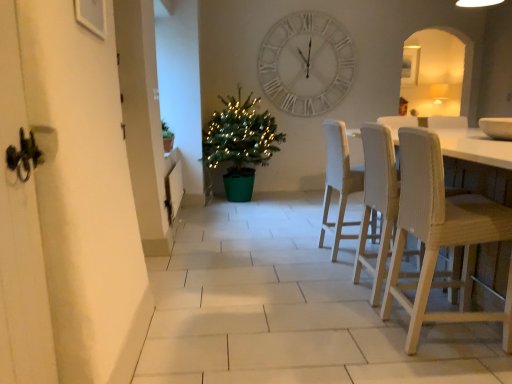
What do you see at coordinates (306, 63) in the screenshot? The height and width of the screenshot is (384, 512). I see `white matte wall clock at upper center` at bounding box center [306, 63].

This screenshot has width=512, height=384. I want to click on green plastic potted plant at center, so click(240, 143).

The height and width of the screenshot is (384, 512). Describe the element at coordinates (339, 182) in the screenshot. I see `white fabric chair at center, which is counted as the first chair, starting from the back` at that location.

What is the approximate width of white woven chair at right, marked as the second chair in a front-to-back arrangement?

white woven chair at right, marked as the second chair in a front-to-back arrangement, is 50.85 centimeters in width.

Where is `white matte wall clock at upper center`? This screenshot has width=512, height=384. white matte wall clock at upper center is located at coordinates (306, 63).

Does green plastic potted plant at center have a greater width compared to white matte wall clock at upper center?

Indeed, green plastic potted plant at center has a greater width compared to white matte wall clock at upper center.

Is green plastic potted plant at center beside white matte wall clock at upper center?

No, green plastic potted plant at center is not next to white matte wall clock at upper center.

How different are the orientations of green plastic potted plant at center and white matte wall clock at upper center in degrees?

1.63 degrees separate the facing orientations of green plastic potted plant at center and white matte wall clock at upper center.

Would you say white woven chair at right, which is counted as the 3th chair, starting from the back, is inside or outside white woven chair at right, the 2th chair from the back?

white woven chair at right, which is counted as the 3th chair, starting from the back, is not inside white woven chair at right, the 2th chair from the back, it's outside.

Considering the relative sizes of white woven chair at right, which is counted as the 3th chair, starting from the back, and white woven chair at right, marked as the second chair in a front-to-back arrangement, in the image provided, is white woven chair at right, which is counted as the 3th chair, starting from the back, wider than white woven chair at right, marked as the second chair in a front-to-back arrangement,?

In fact, white woven chair at right, which is counted as the 3th chair, starting from the back, might be narrower than white woven chair at right, marked as the second chair in a front-to-back arrangement.

Which chair is the 1st one when counting from the left side of the white woven chair at right, which appears as the first chair when viewed from the front? Please provide its 2D coordinates.

[(379, 193)]

Consider the image. Does white woven chair at right, which appears as the first chair when viewed from the front, turn towards white woven chair at right, marked as the second chair in a front-to-back arrangement?

No, white woven chair at right, which appears as the first chair when viewed from the front, is not oriented towards white woven chair at right, marked as the second chair in a front-to-back arrangement.

Is the position of white woven chair at right, which is counted as the 3th chair, starting from the back, more distant than that of white matte wall clock at upper center?

No, the depth of white woven chair at right, which is counted as the 3th chair, starting from the back, is less than that of white matte wall clock at upper center.

Does white woven chair at right, which appears as the first chair when viewed from the front, appear on the left side of white matte wall clock at upper center?

No, white woven chair at right, which appears as the first chair when viewed from the front, is not to the left of white matte wall clock at upper center.

Looking at this image, is white woven chair at right, which appears as the first chair when viewed from the front, not close to white matte wall clock at upper center?

Yes.

Is white woven chair at right, which is counted as the 3th chair, starting from the back, aimed at white matte wall clock at upper center?

No, white woven chair at right, which is counted as the 3th chair, starting from the back, does not turn towards white matte wall clock at upper center.

Starting from the white fabric chair at center, acting as the third chair starting from the front, which chair is the 1st one in front? Please provide its 2D coordinates.

[(379, 193)]

Considering the sizes of white woven chair at right, marked as the second chair in a front-to-back arrangement, and white fabric chair at center, acting as the third chair starting from the front, in the image, is white woven chair at right, marked as the second chair in a front-to-back arrangement, taller or shorter than white fabric chair at center, acting as the third chair starting from the front,?

Considering their sizes, white woven chair at right, marked as the second chair in a front-to-back arrangement, has less height than white fabric chair at center, acting as the third chair starting from the front.

Can you tell me how much white woven chair at right, the 2th chair from the back, and white fabric chair at center, acting as the third chair starting from the front, differ in facing direction?

The angle between the facing direction of white woven chair at right, the 2th chair from the back, and the facing direction of white fabric chair at center, acting as the third chair starting from the front, is 2.5 degrees.

Can you confirm if white woven chair at right, marked as the second chair in a front-to-back arrangement, is positioned to the right of white fabric chair at center, acting as the third chair starting from the front?

Yes.

Is white fabric chair at center, which is counted as the first chair, starting from the back, next to white woven chair at right, the 2th chair from the back, and touching it?

No.

Relative to white woven chair at right, the 2th chair from the back, is white fabric chair at center, acting as the third chair starting from the front, in front or behind?

In the image, white fabric chair at center, acting as the third chair starting from the front, appears behind white woven chair at right, the 2th chair from the back.

From a real-world perspective, is white fabric chair at center, acting as the third chair starting from the front, on top of white woven chair at right, the 2th chair from the back?

No.

Who is smaller, white fabric chair at center, which is counted as the first chair, starting from the back, or white woven chair at right, marked as the second chair in a front-to-back arrangement?

Smaller between the two is white woven chair at right, marked as the second chair in a front-to-back arrangement.

Which object is further away from the camera, white woven chair at right, the 2th chair from the back, or white matte wall clock at upper center?

white matte wall clock at upper center is more distant.

Is point (376, 266) closer or farther from the camera than point (303, 82)?

Point (376, 266) is closer to the camera than point (303, 82).

Considering the sizes of objects white woven chair at right, the 2th chair from the back, and white matte wall clock at upper center in the image provided, who is thinner, white woven chair at right, the 2th chair from the back, or white matte wall clock at upper center?

Thinner between the two is white matte wall clock at upper center.

Can you confirm if white woven chair at right, marked as the second chair in a front-to-back arrangement, is taller than white matte wall clock at upper center?

In fact, white woven chair at right, marked as the second chair in a front-to-back arrangement, may be shorter than white matte wall clock at upper center.

Considering the sizes of objects green plastic potted plant at center and white fabric chair at center, acting as the third chair starting from the front, in the image provided, who is bigger, green plastic potted plant at center or white fabric chair at center, acting as the third chair starting from the front,?

With larger size is green plastic potted plant at center.

How many degrees apart are the facing directions of green plastic potted plant at center and white fabric chair at center, which is counted as the first chair, starting from the back?

They differ by 94.1 degrees in their facing directions.

You are a GUI agent. You are given a task and a screenshot of the screen. Output one action in this format:
    pyautogui.click(x=<x>, y=<y>)
    Task: Click on the 1st chair positioned below the green plastic potted plant at center (from the image's perspective)
    This screenshot has width=512, height=384.
    Given the screenshot: What is the action you would take?
    pyautogui.click(x=339, y=182)

Are green plastic potted plant at center and white fabric chair at center, acting as the third chair starting from the front, located far from each other?

Absolutely, green plastic potted plant at center is distant from white fabric chair at center, acting as the third chair starting from the front.

Locate an element on the screen. wall clock on the right of green plastic potted plant at center is located at coordinates (306, 63).

Which chair is the 1st one when counting from the left side of the white woven chair at right, which appears as the first chair when viewed from the front? Please provide its 2D coordinates.

[(379, 193)]

Considering their positions, is green plastic potted plant at center positioned closer to white fabric chair at center, which is counted as the first chair, starting from the back, than white woven chair at right, the 2th chair from the back?

Based on the image, white woven chair at right, the 2th chair from the back, appears to be nearer to white fabric chair at center, which is counted as the first chair, starting from the back.

When comparing their distances from white fabric chair at center, acting as the third chair starting from the front, does white woven chair at right, the 2th chair from the back, or white woven chair at right, which is counted as the 3th chair, starting from the back, seem closer?

Based on the image, white woven chair at right, the 2th chair from the back, appears to be nearer to white fabric chair at center, acting as the third chair starting from the front.

Considering their positions, is white matte wall clock at upper center positioned further to white woven chair at right, the 2th chair from the back, than white fabric chair at center, acting as the third chair starting from the front?

Among the two, white matte wall clock at upper center is located further to white woven chair at right, the 2th chair from the back.

Estimate the real-world distances between objects in this image. Which object is further from white fabric chair at center, acting as the third chair starting from the front, white woven chair at right, which appears as the first chair when viewed from the front, or white matte wall clock at upper center?

white matte wall clock at upper center.

Based on their spatial positions, is white woven chair at right, the 2th chair from the back, or white fabric chair at center, which is counted as the first chair, starting from the back, closer to white woven chair at right, which appears as the first chair when viewed from the front?

Based on the image, white woven chair at right, the 2th chair from the back, appears to be nearer to white woven chair at right, which appears as the first chair when viewed from the front.

Based on their spatial positions, is green plastic potted plant at center or white woven chair at right, the 2th chair from the back, further from white matte wall clock at upper center?

Among the two, white woven chair at right, the 2th chair from the back, is located further to white matte wall clock at upper center.

When comparing their distances from white woven chair at right, which appears as the first chair when viewed from the front, does white matte wall clock at upper center or white woven chair at right, the 2th chair from the back, seem closer?

Based on the image, white woven chair at right, the 2th chair from the back, appears to be nearer to white woven chair at right, which appears as the first chair when viewed from the front.

Based on their spatial positions, is white fabric chair at center, which is counted as the first chair, starting from the back, or white woven chair at right, the 2th chair from the back, further from green plastic potted plant at center?

Among the two, white woven chair at right, the 2th chair from the back, is located further to green plastic potted plant at center.

Where is `houseplant positioned between white fabric chair at center, which is counted as the first chair, starting from the back, and white matte wall clock at upper center from near to far`? The height and width of the screenshot is (384, 512). houseplant positioned between white fabric chair at center, which is counted as the first chair, starting from the back, and white matte wall clock at upper center from near to far is located at coordinates (240, 143).

Find the location of `chair between white woven chair at right, marked as the second chair in a front-to-back arrangement, and white matte wall clock at upper center, along the z-axis`. chair between white woven chair at right, marked as the second chair in a front-to-back arrangement, and white matte wall clock at upper center, along the z-axis is located at coordinates (339, 182).

What are the coordinates of `houseplant between white woven chair at right, which appears as the first chair when viewed from the front, and white matte wall clock at upper center in the front-back direction` in the screenshot? It's located at tap(240, 143).

At what (x,y) coordinates should I click in order to perform the action: click on chair between white woven chair at right, which is counted as the 3th chair, starting from the back, and white fabric chair at center, acting as the third chair starting from the front, from front to back. Please return your answer as a coordinate pair (x, y). Looking at the image, I should click on (379, 193).